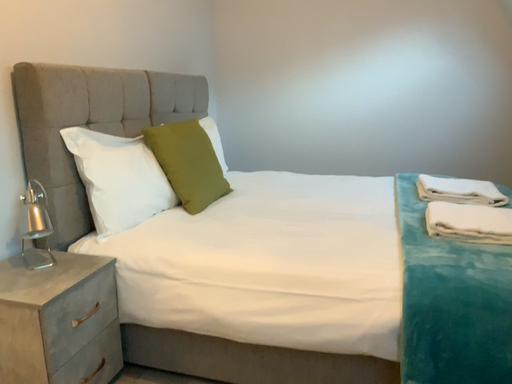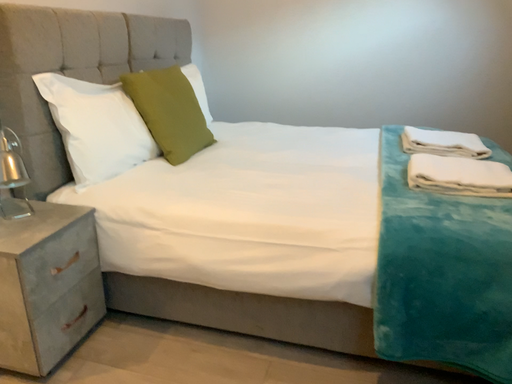
Question: Which way did the camera rotate in the video?

Choices:
 (A) rotated upward
 (B) rotated downward

Answer: (B)